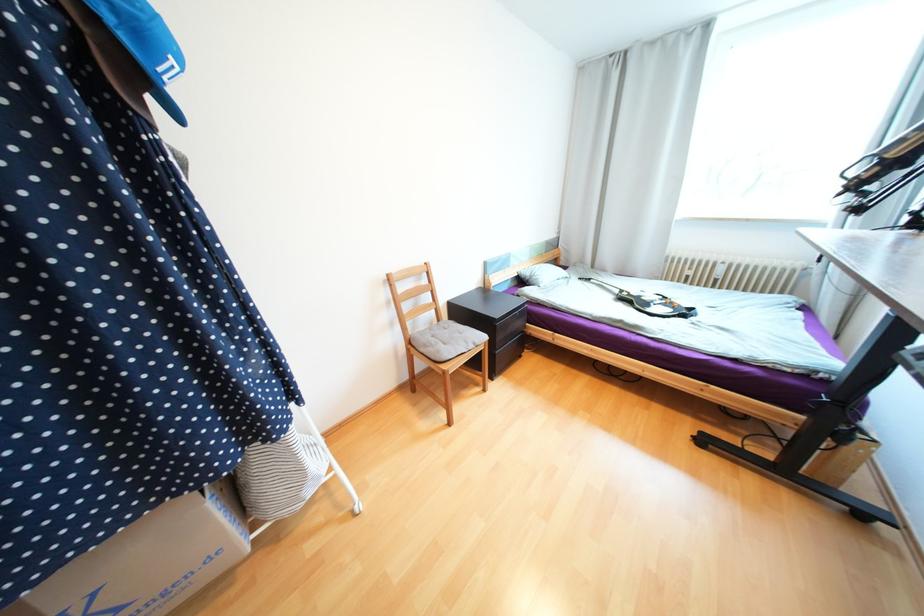
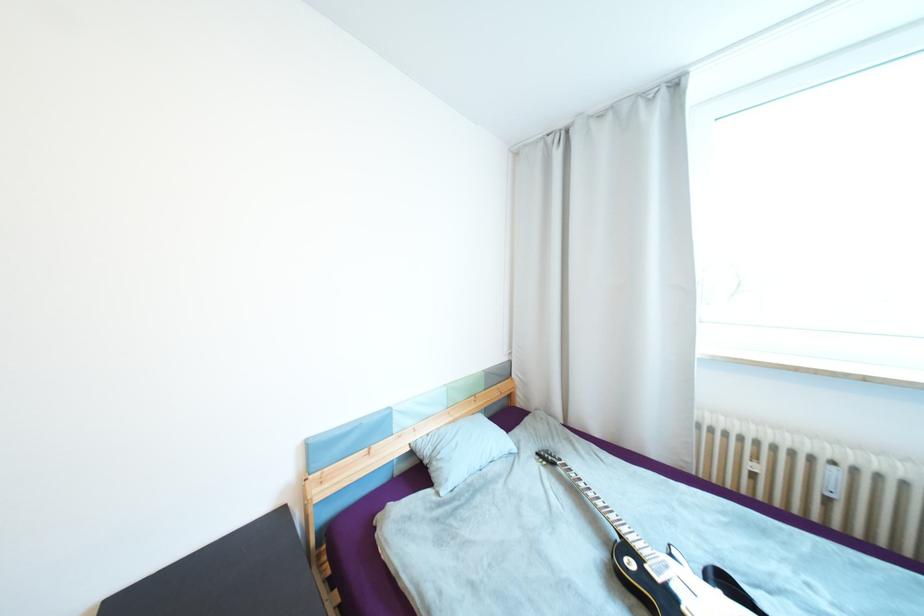
The images are taken continuously from a first-person perspective. In which direction are you moving?

The movement direction of the cameraman is right, forward.